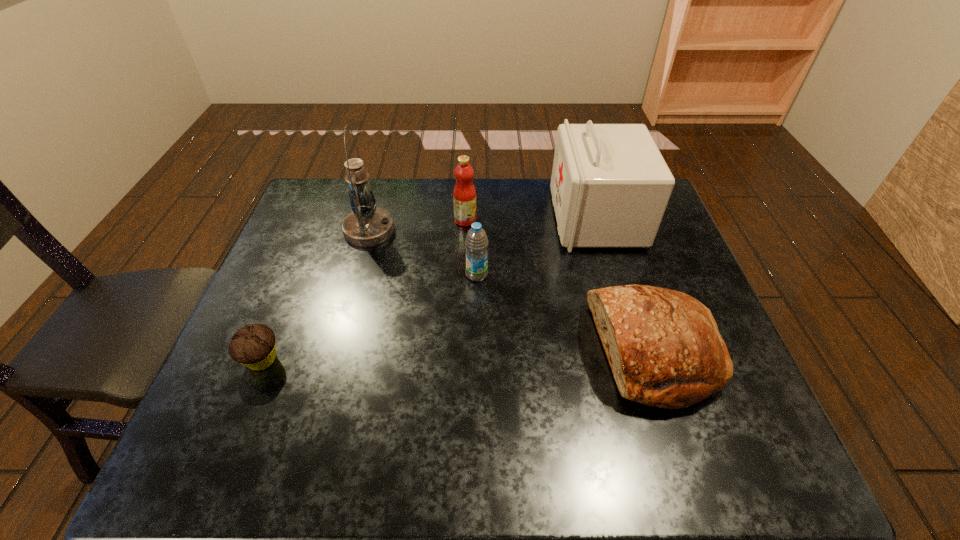
The width and height of the screenshot is (960, 540). What are the coordinates of `object that is at the left edge` in the screenshot? It's located at (253, 346).

This screenshot has width=960, height=540. I want to click on the first-aid kit that is at the right edge, so pyautogui.click(x=610, y=186).

Image resolution: width=960 pixels, height=540 pixels. I want to click on bread positioned at the right edge, so click(x=663, y=346).

In order to click on object located in the far right corner section of the desktop in this screenshot , I will do `click(610, 186)`.

Where is `free space at the far edge of the desktop`? The image size is (960, 540). free space at the far edge of the desktop is located at coordinates (475, 186).

Find the location of `vacant region at the near edge of the desktop`. vacant region at the near edge of the desktop is located at coordinates (610, 466).

Identify the location of free space at the left edge of the desktop. Image resolution: width=960 pixels, height=540 pixels. (237, 377).

You are a GUI agent. You are given a task and a screenshot of the screen. Output one action in this format:
    pyautogui.click(x=<x>, y=<y>)
    Task: Click on the free region at the right edge of the desktop
    The width and height of the screenshot is (960, 540).
    Given the screenshot: What is the action you would take?
    pyautogui.click(x=663, y=242)

Where is `free space at the far left corner of the desktop`? The image size is (960, 540). free space at the far left corner of the desktop is located at coordinates (314, 195).

At what (x,y) coordinates should I click in order to perform the action: click on vacant area between the water bottle and the bread. Please return your answer as a coordinate pair (x, y). The height and width of the screenshot is (540, 960). Looking at the image, I should click on (565, 313).